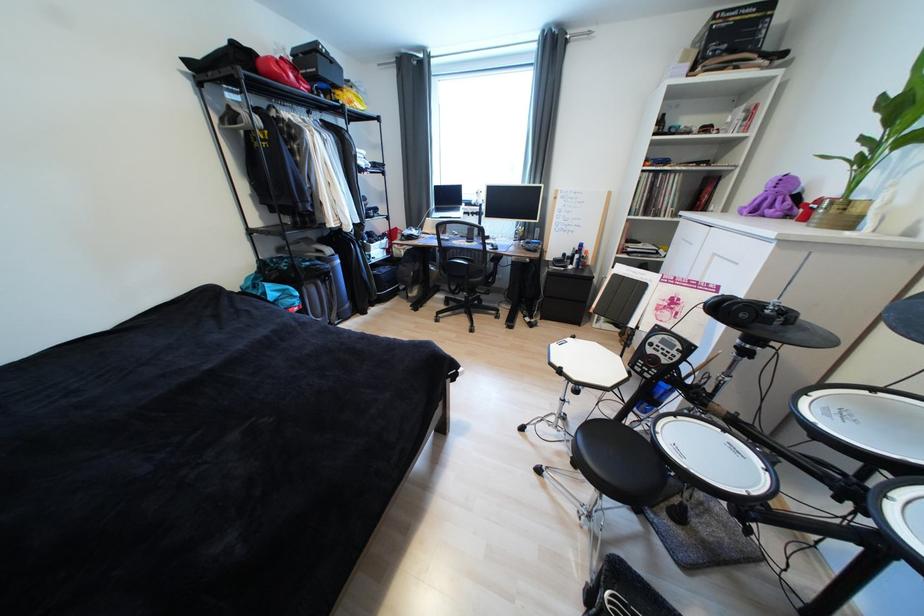
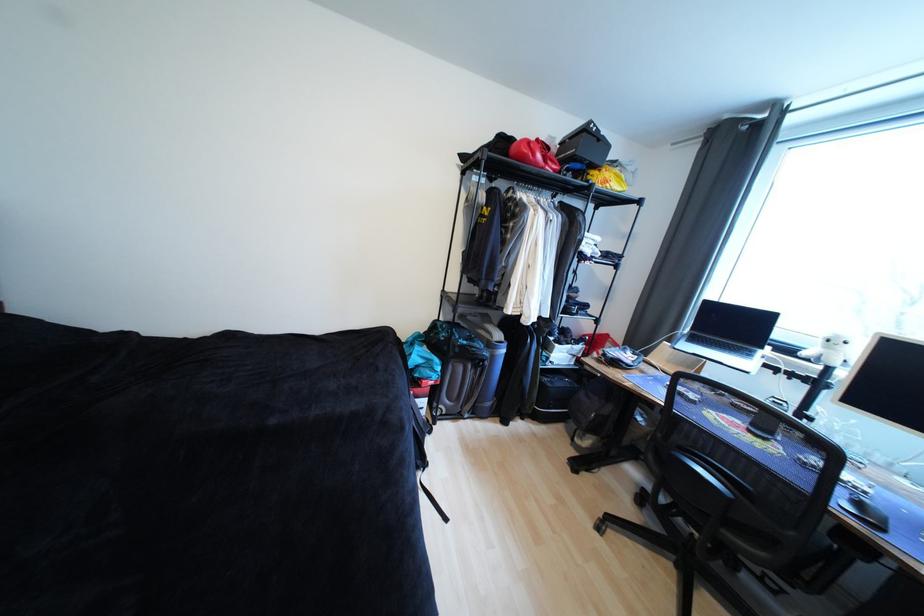
Locate, in the second image, the point that corresponds to the point at 284,79 in the first image.

(529, 159)